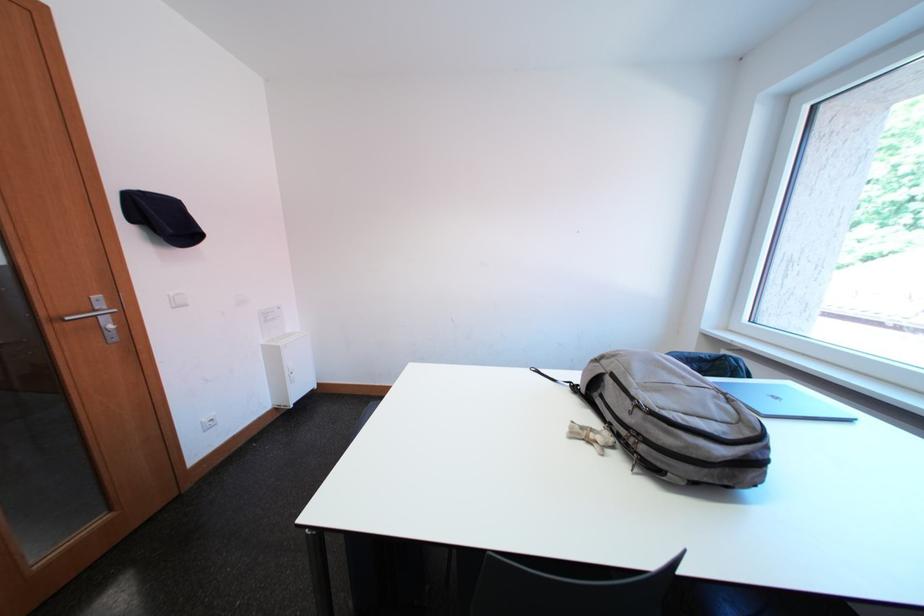
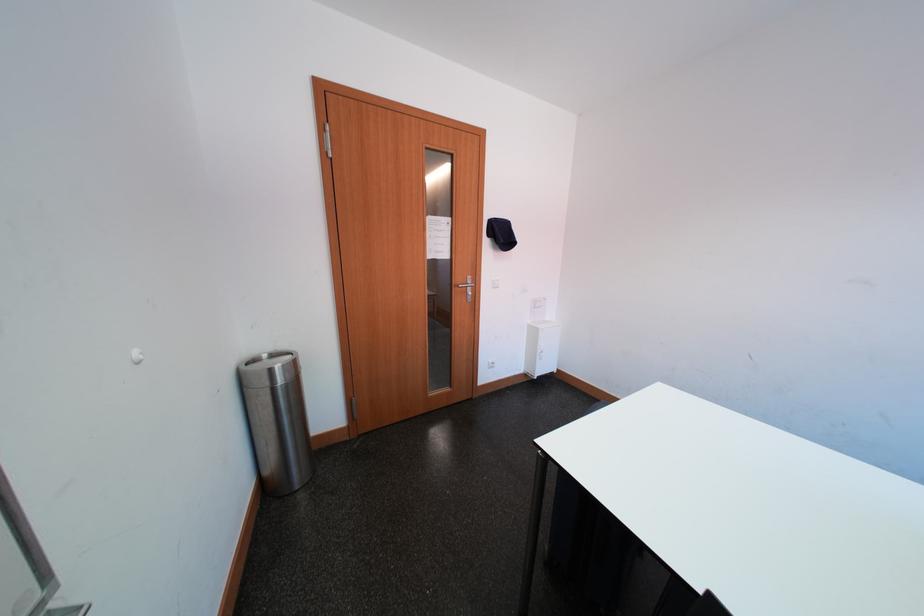
Question: The camera is either moving clockwise (left) or counter-clockwise (right) around the object. The first image is from the beginning of the video and the second image is from the end. Is the camera moving left or right when shooting the video?

Choices:
 (A) Left
 (B) Right

Answer: (B)